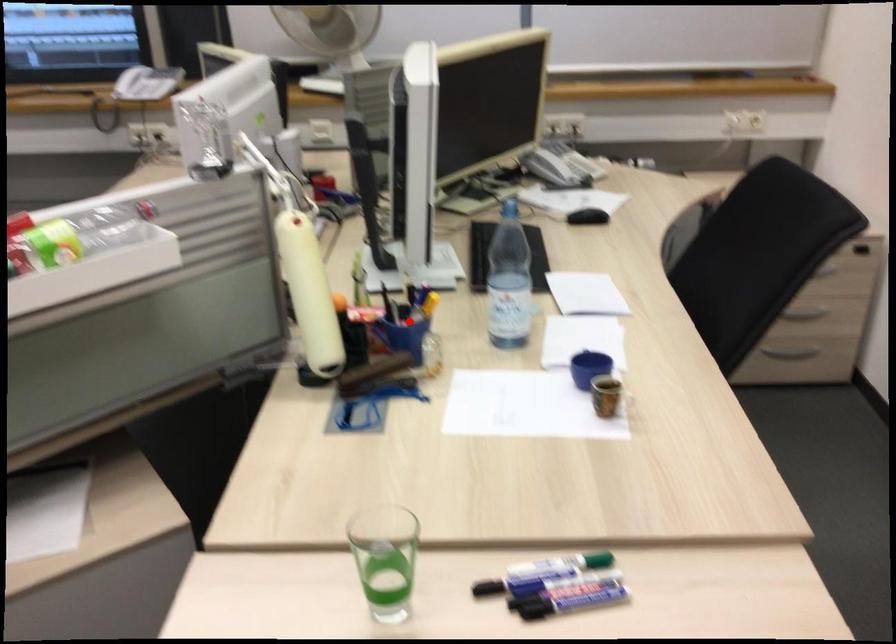
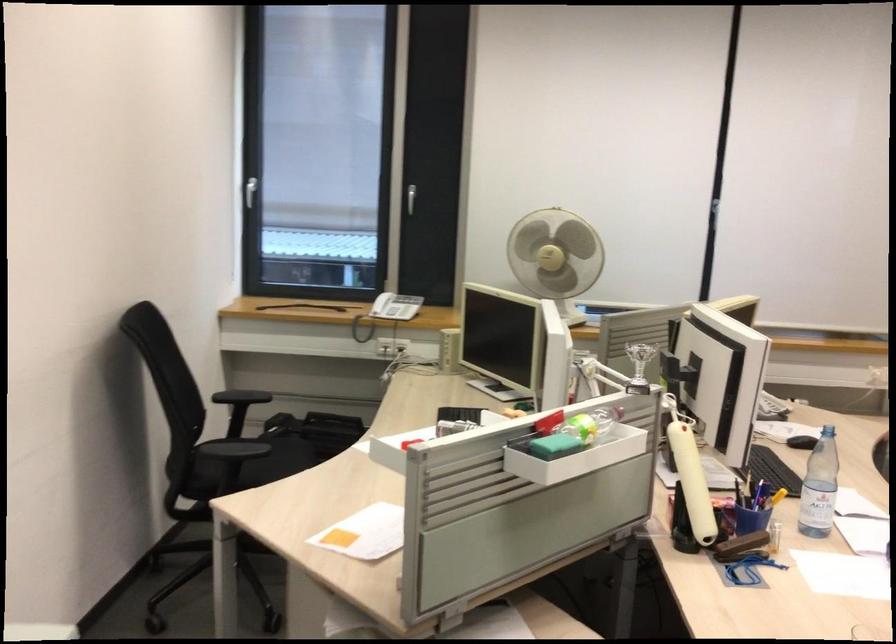
Question: I am providing you with two images of the same scene from different viewpoints. In image1, a red point is highlighted. Considering the same 3D point in image2, which of the following is correct?

Choices:
 (A) It is closer
 (B) It is farther

Answer: (B)